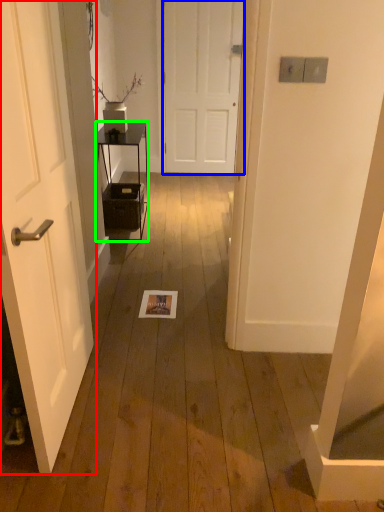
Question: Which object is positioned closest to door (highlighted by a red box)? Select from door (highlighted by a blue box) and furniture (highlighted by a green box).

Choices:
 (A) door
 (B) furniture

Answer: (B)